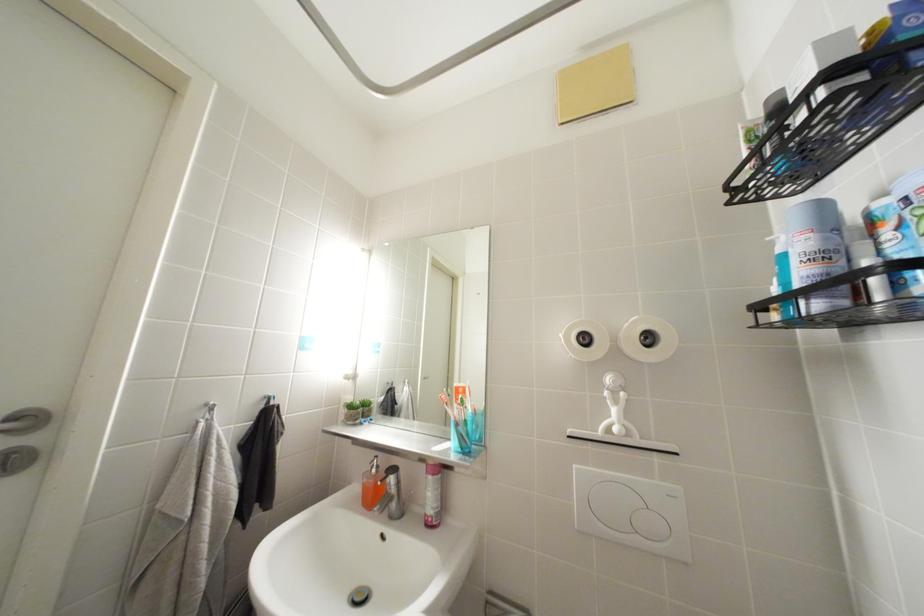
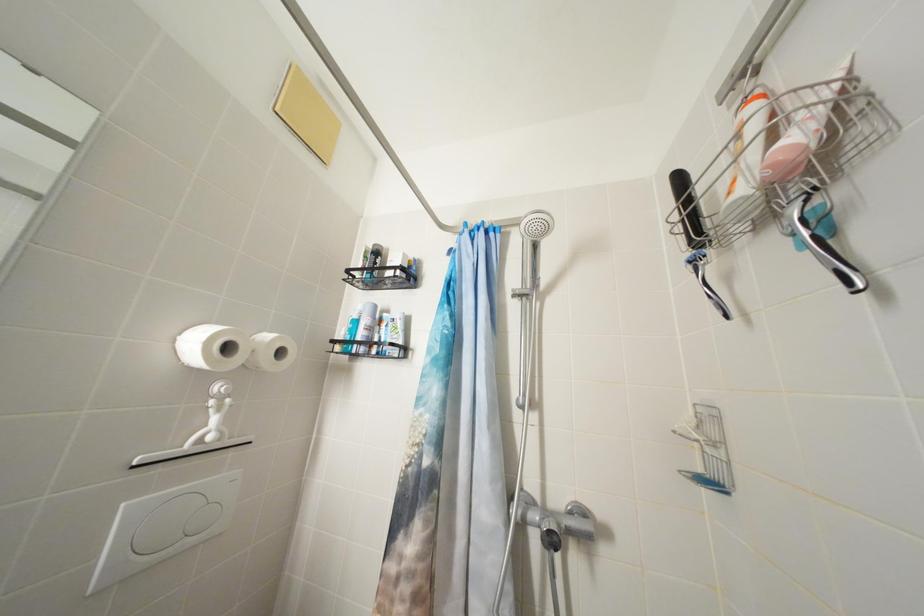
Question: The camera is either moving clockwise (left) or counter-clockwise (right) around the object. The first image is from the beginning of the video and the second image is from the end. Is the camera moving left or right when shooting the video?

Choices:
 (A) Left
 (B) Right

Answer: (A)